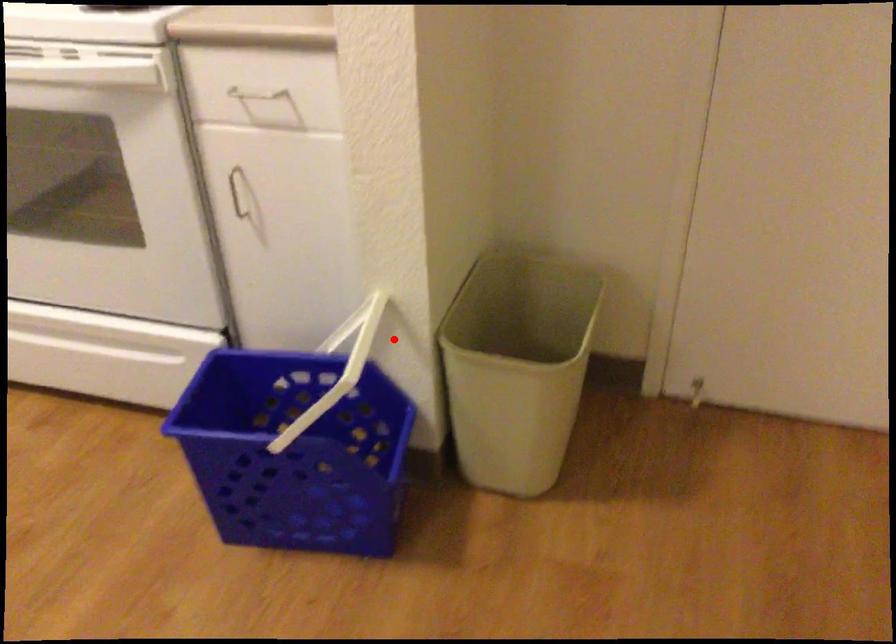
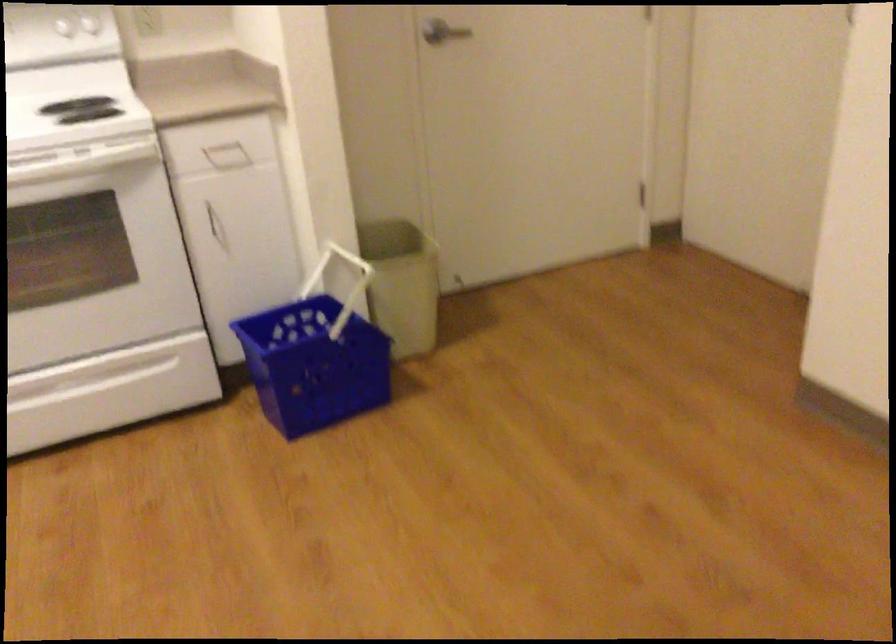
The point at the highlighted location is marked in the first image. Where is the corresponding point in the second image?

(337, 272)